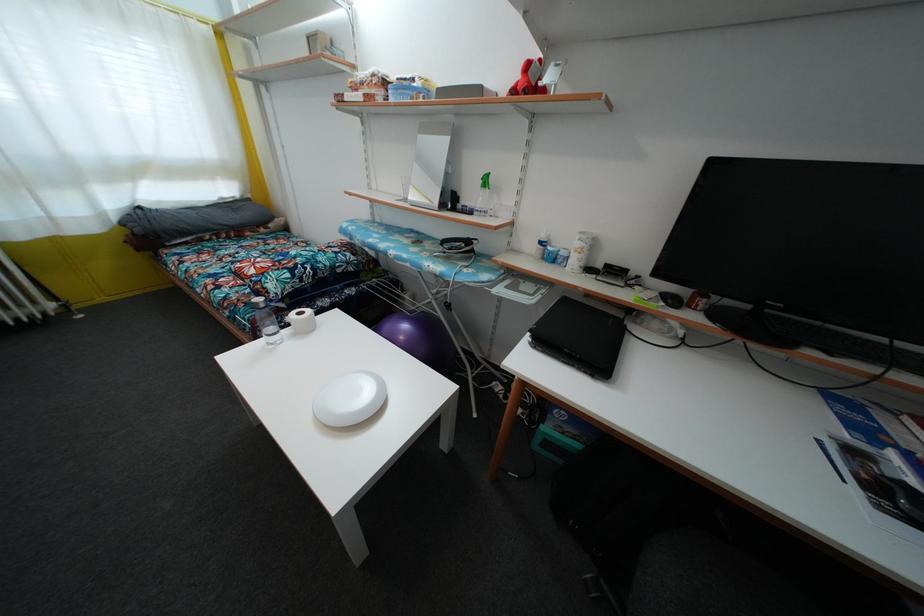
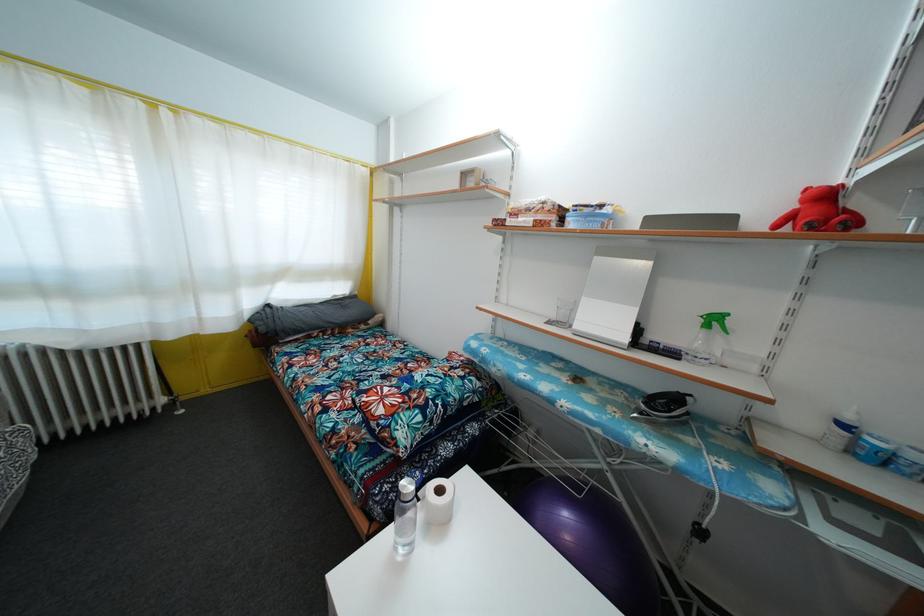
Where in the second image is the point corresponding to pixel 544 249 from the first image?

(848, 432)